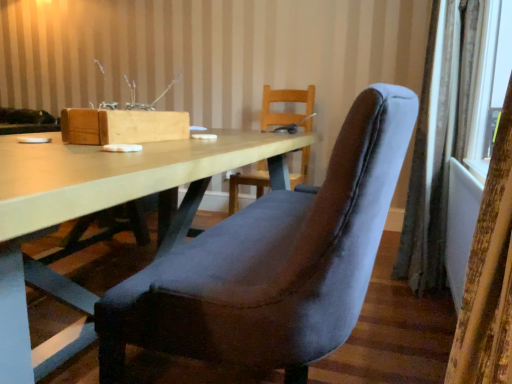
Question: Would you say matte wood table at center is inside or outside velvet curtain at right, the 2th curtain from the front?

Choices:
 (A) outside
 (B) inside

Answer: (A)

Question: Based on their positions, is matte wood table at center located to the left or right of velvet curtain at right, the 2th curtain from the front?

Choices:
 (A) left
 (B) right

Answer: (A)

Question: Considering the real-world distances, which object is closest to the matte wood table at center?

Choices:
 (A) velvet curtain at right, acting as the first curtain starting from the front
 (B) velvet blue chair at center
 (C) velvet curtain at right, the 2th curtain from the front

Answer: (B)

Question: Which object is positioned closest to the velvet curtain at right, acting as the first curtain starting from the left?

Choices:
 (A) matte wood table at center
 (B) velvet blue chair at center
 (C) velvet curtain at right, the first curtain positioned from the right

Answer: (B)